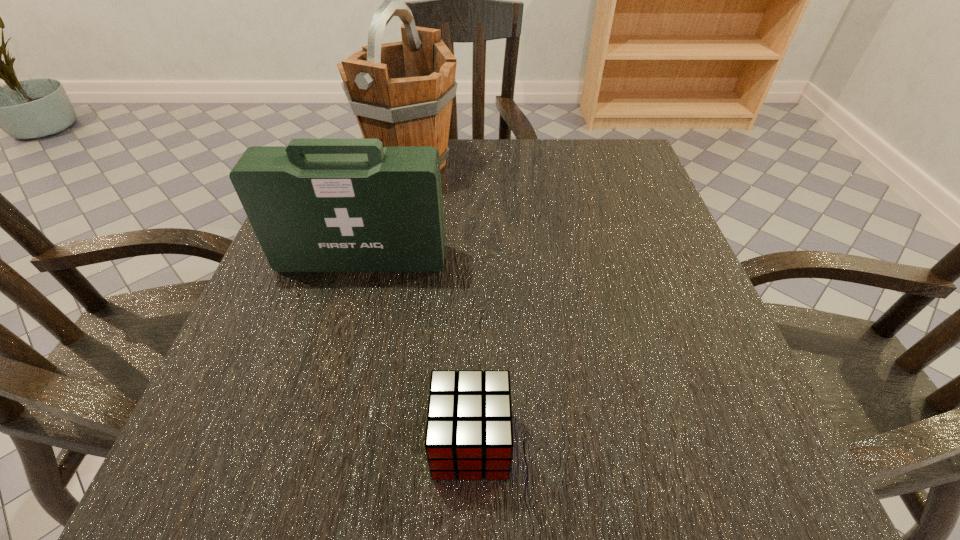
In order to click on object present at the near edge in this screenshot , I will do `click(469, 431)`.

Identify the location of bucket present at the left edge. Image resolution: width=960 pixels, height=540 pixels. (401, 93).

Locate an element on the screen. The height and width of the screenshot is (540, 960). the first-aid kit that is at the left edge is located at coordinates (317, 205).

This screenshot has width=960, height=540. Identify the location of object at the far left corner. [401, 93].

Where is `blank space at the far edge of the desktop`? Image resolution: width=960 pixels, height=540 pixels. blank space at the far edge of the desktop is located at coordinates (464, 171).

In the image, there is a desktop. At what (x,y) coordinates should I click in order to perform the action: click on vacant space at the left edge. Please return your answer as a coordinate pair (x, y). Image resolution: width=960 pixels, height=540 pixels. Looking at the image, I should click on (327, 300).

In the image, there is a desktop. Where is `vacant space at the right edge`? This screenshot has width=960, height=540. vacant space at the right edge is located at coordinates [x=621, y=313].

Where is `free space at the near left corner`? The image size is (960, 540). free space at the near left corner is located at coordinates click(x=232, y=471).

Locate an element on the screen. Image resolution: width=960 pixels, height=540 pixels. blank space at the far right corner of the desktop is located at coordinates (622, 165).

This screenshot has height=540, width=960. In the image, there is a desktop. Find the location of `free space at the near right corner`. free space at the near right corner is located at coordinates (780, 496).